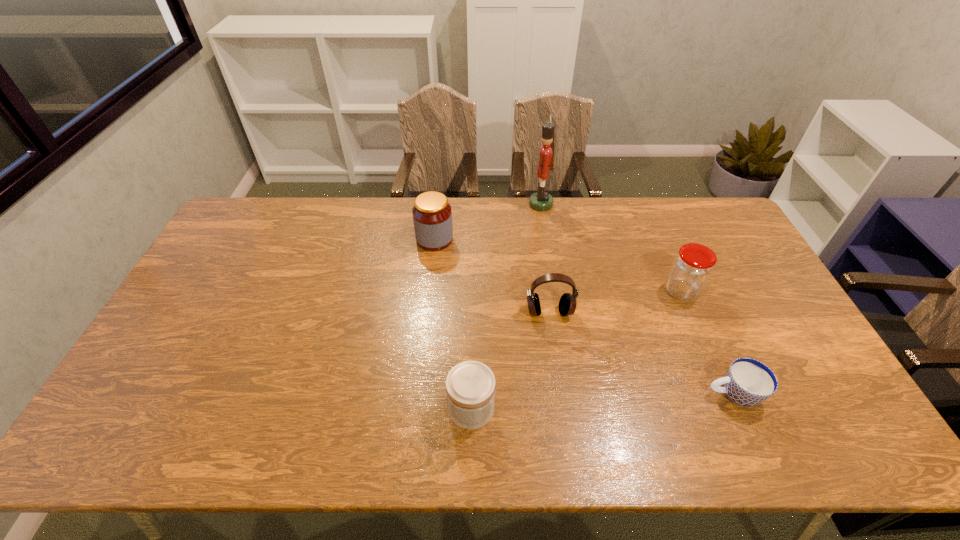
Where is `vacant region located on the front-facing side of the tallest object`? The image size is (960, 540). vacant region located on the front-facing side of the tallest object is located at coordinates coord(497,204).

Where is `free space located on the front-facing side of the tallest object`? free space located on the front-facing side of the tallest object is located at coordinates (449, 204).

This screenshot has width=960, height=540. Find the location of `vacant position located on the front of the leftmost object`. vacant position located on the front of the leftmost object is located at coordinates (426, 314).

The image size is (960, 540). I want to click on vacant space located 0.090m on the left of the second nearest jar, so click(x=635, y=291).

Where is `free space located 0.240m on the ear pads of the headset`? Image resolution: width=960 pixels, height=540 pixels. free space located 0.240m on the ear pads of the headset is located at coordinates (562, 396).

Identify the location of free space located 0.160m on the back of the second jar from right to left. This screenshot has height=540, width=960. (472, 336).

Find the location of a particular element. free region located 0.290m on the side of the cup with the handle is located at coordinates [591, 394].

Image resolution: width=960 pixels, height=540 pixels. In order to click on vacant space located on the side of the cup with the handle in this screenshot , I will do `click(547, 394)`.

The image size is (960, 540). In order to click on free space located on the side of the cup with the handle in this screenshot , I will do `click(666, 394)`.

This screenshot has width=960, height=540. What are the coordinates of `nutcracker that is at the far edge` in the screenshot? It's located at (540, 201).